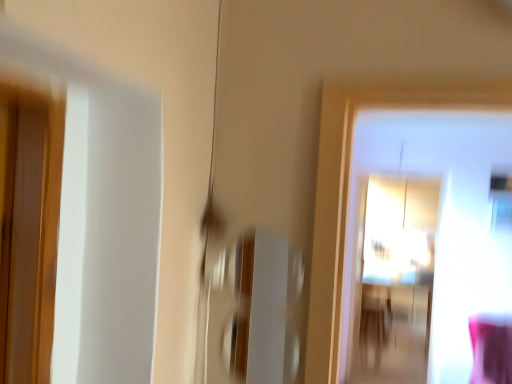
Identify the location of wooden table at center. (375, 314).

Image resolution: width=512 pixels, height=384 pixels. What do you see at coordinates (375, 314) in the screenshot?
I see `wooden table at center` at bounding box center [375, 314].

Where is `wooden table at center`? wooden table at center is located at coordinates (375, 314).